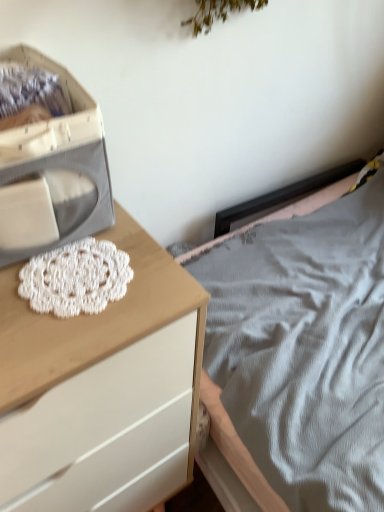
Identify the location of white crochet doily at center-left. (76, 278).

What are the coordinates of `white fabric storage box at left` in the screenshot? It's located at (55, 169).

Describe the element at coordinates (55, 169) in the screenshot. The width and height of the screenshot is (384, 512). I see `white fabric storage box at left` at that location.

Where is `white crochet doily at center-left`? white crochet doily at center-left is located at coordinates (76, 278).

Does white fabric storage box at left have a lesser height compared to white wood chest of drawers at left?

Yes.

Would you consider white fabric storage box at left to be distant from white wood chest of drawers at left?

That's not correct — white fabric storage box at left is a little close to white wood chest of drawers at left.

Looking at their sizes, would you say white fabric storage box at left is wider or thinner than white wood chest of drawers at left?

Considering their sizes, white fabric storage box at left looks slimmer than white wood chest of drawers at left.

Looking at this image, from the image's perspective, is white fabric storage box at left beneath white wood chest of drawers at left?

No, from the image's perspective, white fabric storage box at left is not beneath white wood chest of drawers at left.

Is white crochet doily at center-left at the back of white fabric storage box at left?

white fabric storage box at left is not turned away from white crochet doily at center-left.

Are white fabric storage box at left and white crochet doily at center-left beside each other?

They are not placed beside each other.

This screenshot has height=512, width=384. Find the location of `lace on the right side of white fabric storage box at left`. lace on the right side of white fabric storage box at left is located at coordinates (76, 278).

Is white fabric storage box at left shorter than white crochet doily at center-left?

Incorrect, the height of white fabric storage box at left does not fall short of that of white crochet doily at center-left.

Between white wood chest of drawers at left and white fabric storage box at left, which one has larger size?

white wood chest of drawers at left is bigger.

Visually, is white wood chest of drawers at left positioned to the left or to the right of white fabric storage box at left?

white wood chest of drawers at left is positioned on white fabric storage box at left's left side.

Which of these two, white wood chest of drawers at left or white fabric storage box at left, is wider?

white wood chest of drawers at left is wider.

Which point is more distant from viewer, (139, 351) or (55, 150)?

Point (139, 351)

From the image's perspective, which one is positioned higher, white crochet doily at center-left or white fabric storage box at left?

white fabric storage box at left, from the image's perspective.

Is point (122, 263) farther from camera compared to point (100, 136)?

Yes, point (122, 263) is farther from viewer.

Could you tell me if white crochet doily at center-left is turned towards white fabric storage box at left?

No, white crochet doily at center-left is not facing towards white fabric storage box at left.

Can you tell me how much white crochet doily at center-left and white fabric storage box at left differ in facing direction?

The angle between the facing direction of white crochet doily at center-left and the facing direction of white fabric storage box at left is 9.87e-05 degrees.

Does white wood chest of drawers at left appear on the left side of white crochet doily at center-left?

Yes.

Is white wood chest of drawers at left in contact with white crochet doily at center-left?

No, white wood chest of drawers at left is not with white crochet doily at center-left.

From the image's perspective, is white wood chest of drawers at left above or below white crochet doily at center-left?

white wood chest of drawers at left is below white crochet doily at center-left.

Could you tell me if white wood chest of drawers at left is turned towards white crochet doily at center-left?

No, white wood chest of drawers at left is not aimed at white crochet doily at center-left.

Based on their positions, is white crochet doily at center-left located to the left or right of white wood chest of drawers at left?

From the image, it's evident that white crochet doily at center-left is to the right of white wood chest of drawers at left.

Is point (128, 274) positioned in front of point (133, 335)?

No, it is behind (133, 335).

Which of these two, white crochet doily at center-left or white wood chest of drawers at left, stands shorter?

Standing shorter between the two is white crochet doily at center-left.

The image size is (384, 512). I want to click on storage box on the right of white wood chest of drawers at left, so click(x=55, y=169).

Identify the location of lace that is behind the white fabric storage box at left. (76, 278).

Looking at the image, which one is located closer to white crochet doily at center-left, white fabric storage box at left or white wood chest of drawers at left?

white fabric storage box at left.

In the scene shown: Which object lies nearer to the anchor point white fabric storage box at left, white wood chest of drawers at left or white crochet doily at center-left?

white crochet doily at center-left is positioned closer to the anchor white fabric storage box at left.

Estimate the real-world distances between objects in this image. Which object is further from white wood chest of drawers at left, white crochet doily at center-left or white fabric storage box at left?

white fabric storage box at left is further to white wood chest of drawers at left.

Estimate the real-world distances between objects in this image. Which object is further from white wood chest of drawers at left, white fabric storage box at left or white crochet doily at center-left?

white fabric storage box at left lies further to white wood chest of drawers at left than the other object.

Looking at the image, which one is located further to white crochet doily at center-left, white wood chest of drawers at left or white fabric storage box at left?

The object further to white crochet doily at center-left is white wood chest of drawers at left.

Which object lies further to the anchor point white fabric storage box at left, white crochet doily at center-left or white wood chest of drawers at left?

Based on the image, white wood chest of drawers at left appears to be further to white fabric storage box at left.

Find the location of a particular element. The image size is (384, 512). lace between white fabric storage box at left and white wood chest of drawers at left vertically is located at coordinates (76, 278).